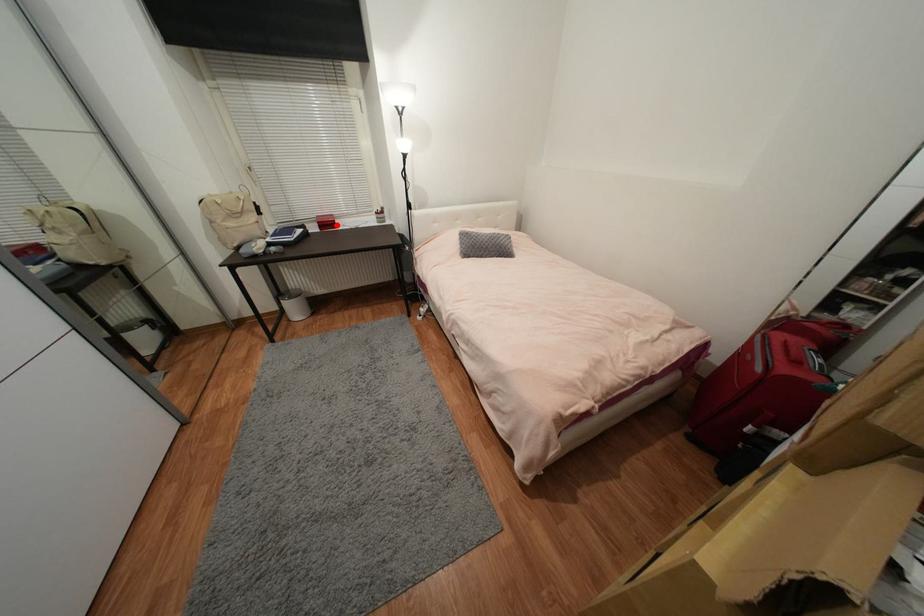
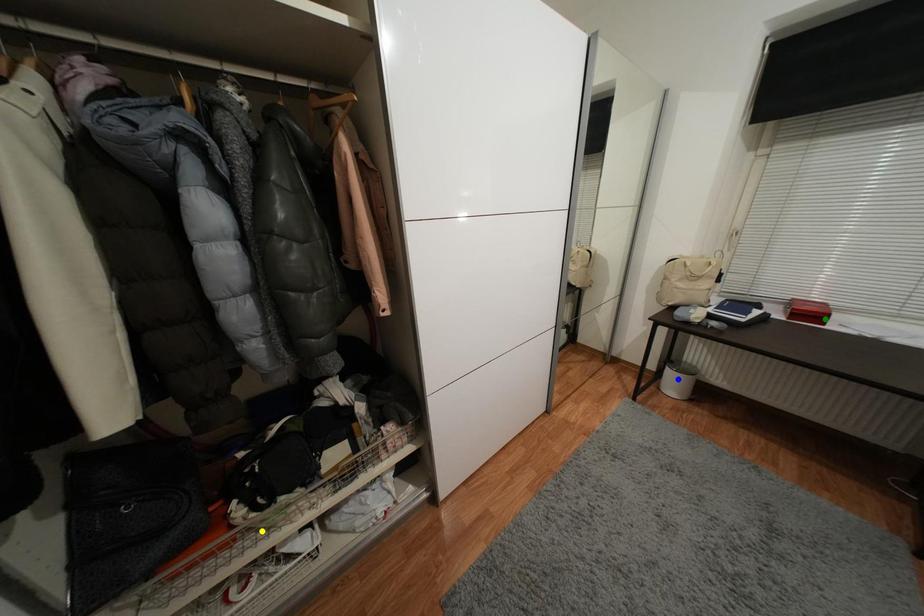
Question: I am providing you with two images of the same scene from different viewpoints. A red point is marked on the first image. You are given multiple points on the second image. Which point in image 2 represents the same 3d spot as the red point in image 1?

Choices:
 (A) blue point
 (B) yellow point
 (C) green point

Answer: (C)